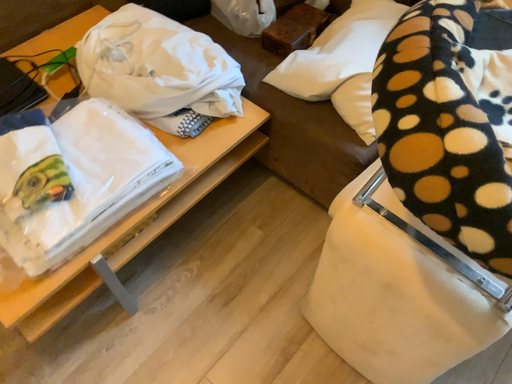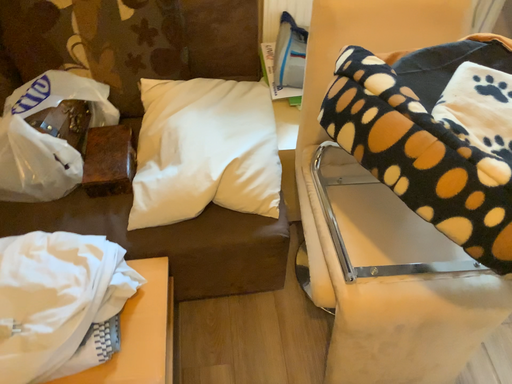
Question: Which way did the camera rotate in the video?

Choices:
 (A) rotated upward
 (B) rotated downward

Answer: (A)